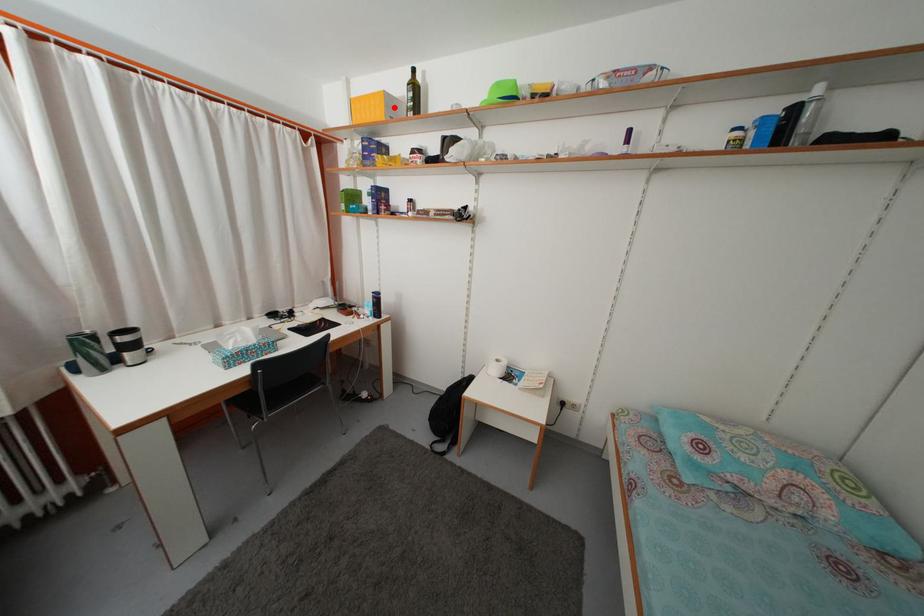
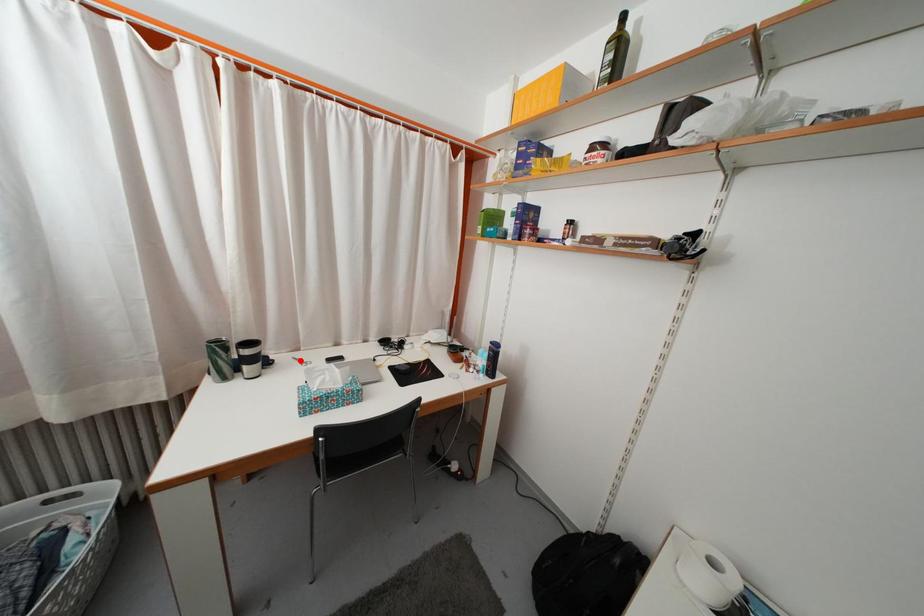
I am providing you with two images of the same scene from different viewpoints. A red point is marked on the first image and another point is marked on the second image. Is the marked point in image1 the same physical position as the marked point in image2?

No